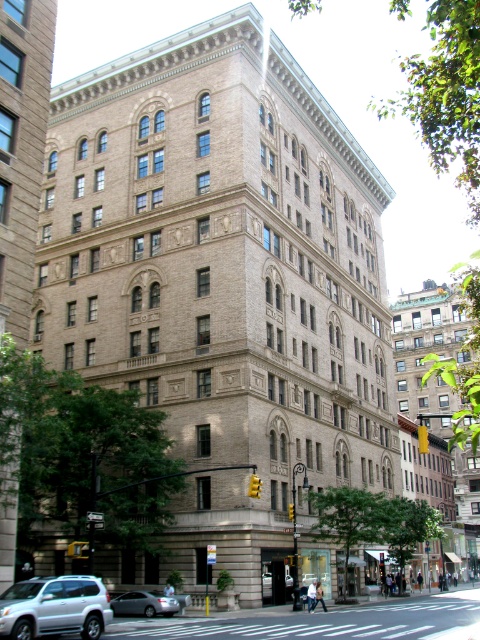
Is the position of silver metallic suv at lower left less distant than that of silver metallic sedan at lower center?

Yes, silver metallic suv at lower left is closer to the viewer.

Which is behind, point (101, 625) or point (144, 609)?

The point (144, 609) is more distant.

I want to click on silver metallic suv at lower left, so click(x=55, y=608).